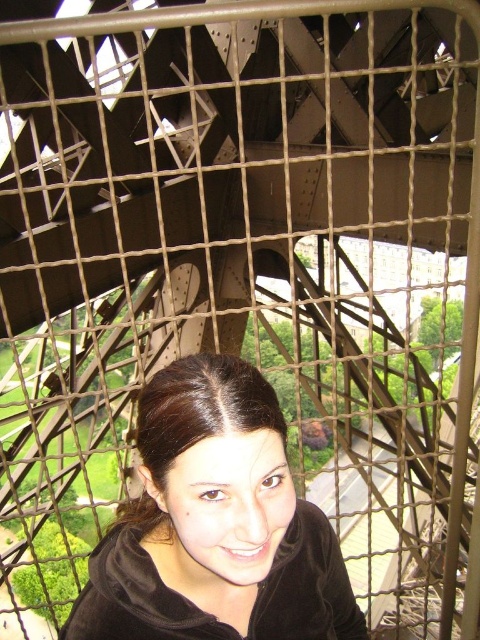
You are a photographer taking a picture of the Eiffel Tower interior. You see the matte black hoodie at center and the dark brown hair at center. Which object is closer to the camera lens?

The matte black hoodie at center is positioned under dark brown hair at center, so the dark brown hair at center is closer to the camera lens.

You are a photographer planning to take a portrait of the person inside the Eiffel Tower. Given that you want to ensure the matte black hoodie at center and dark brown hair at center are both visible in the frame, which object should you focus on to maintain both in the shot?

The matte black hoodie at center is much taller than the dark brown hair at center, so focusing on the matte black hoodie at center will ensure both are in the frame since it is taller and provides a better reference point.